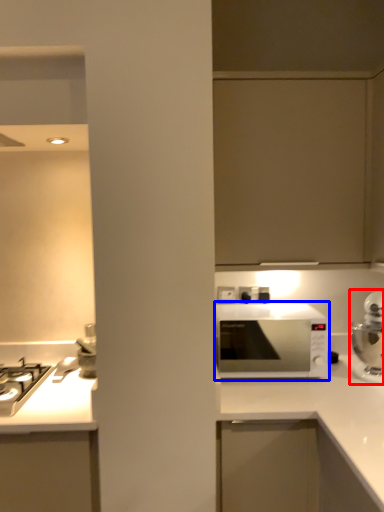
Question: Among these objects, which one is nearest to the camera, home appliance (highlighted by a red box) or microwave oven (highlighted by a blue box)?

Choices:
 (A) home appliance
 (B) microwave oven

Answer: (A)